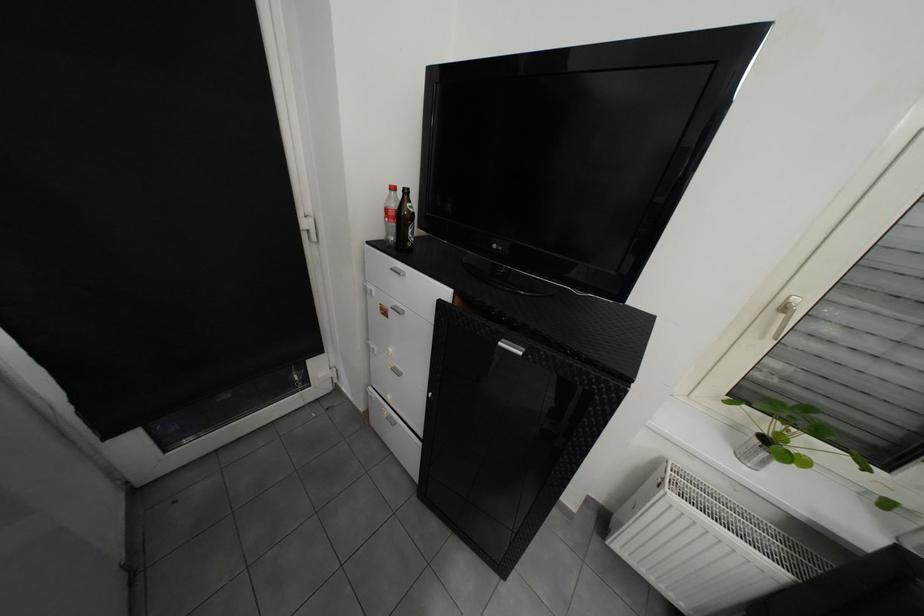
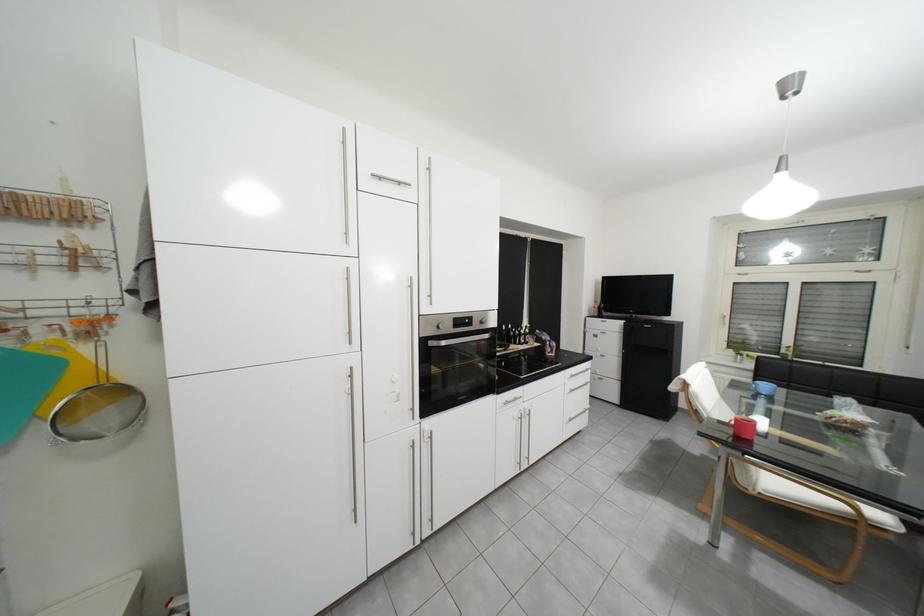
In a continuous first-person perspective shot, in which direction is the camera moving?

The cameraman walked toward left, backward.